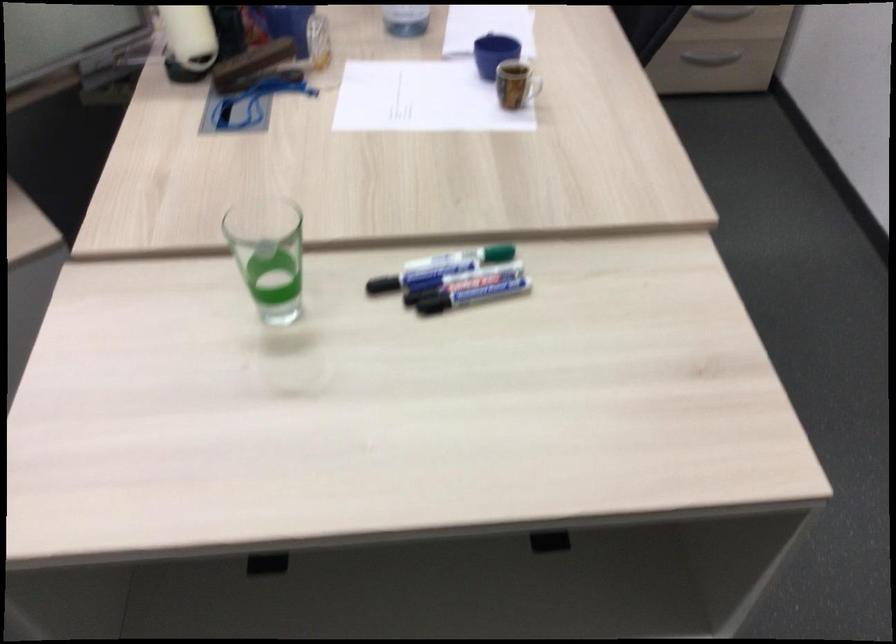
Where would you pull the black drawer handle? Please return your answer as a coordinate pair (x, y).

(734, 22)